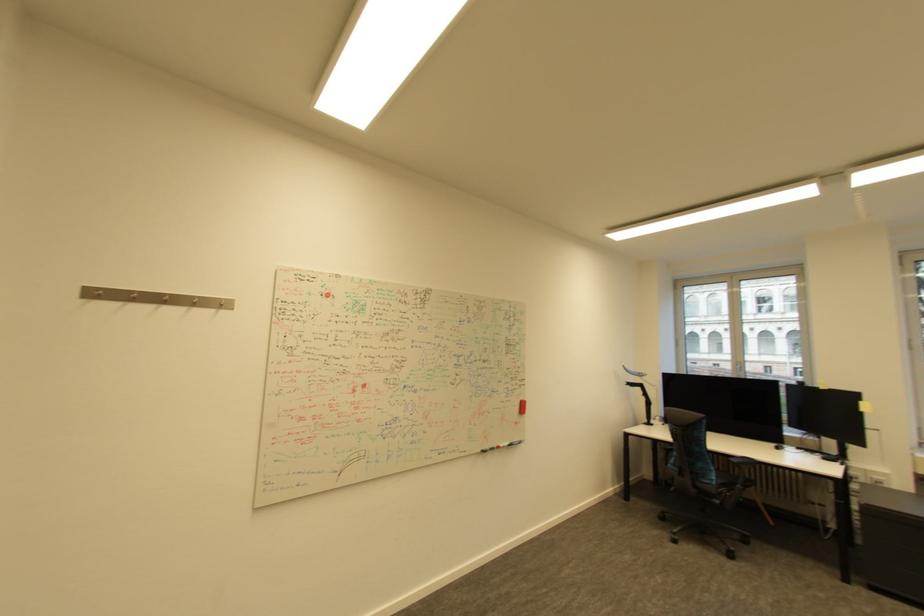
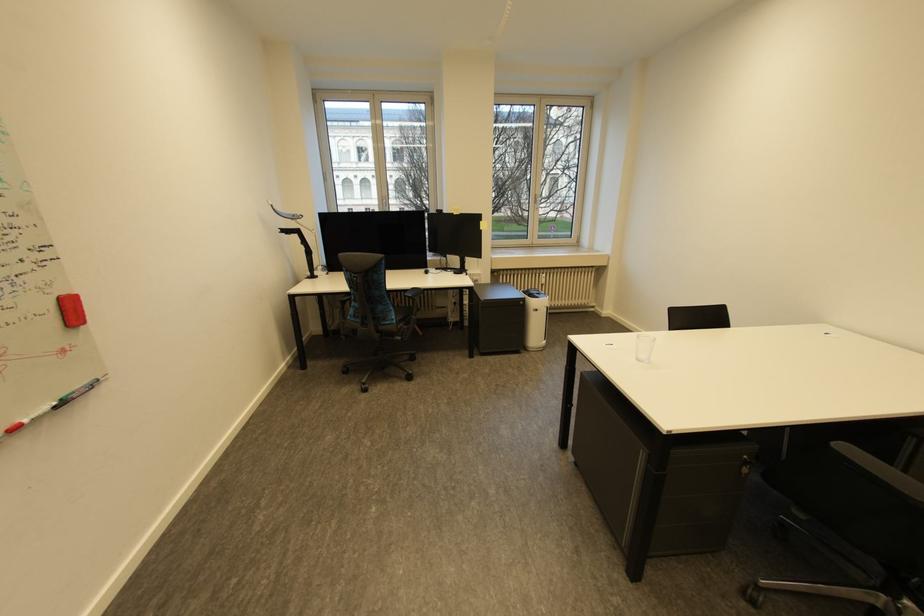
In the second image, find the point that corresponds to (x=503, y=447) in the first image.

(6, 436)